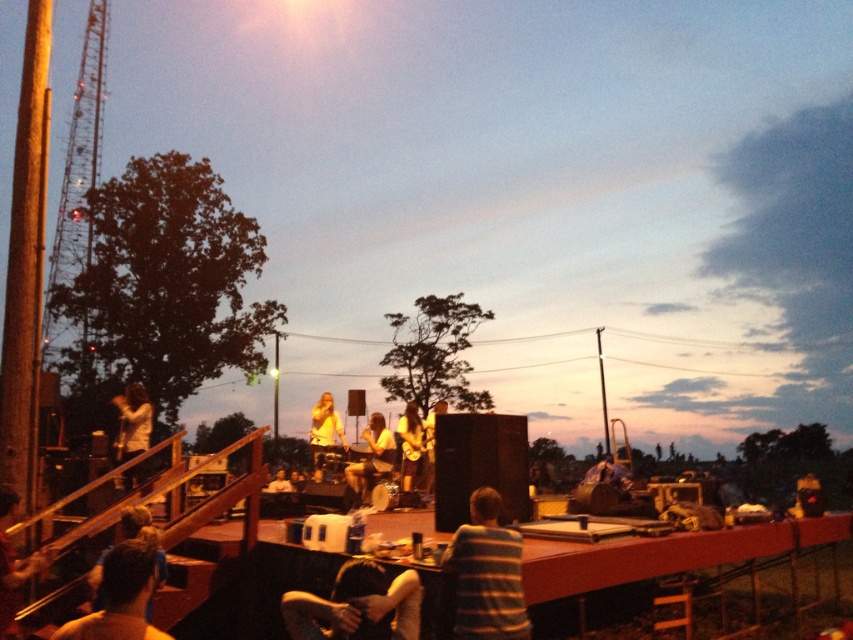
Is shiny blonde hair at center further to camera compared to smooth skin person at center?

Yes, shiny blonde hair at center is behind smooth skin person at center.

This screenshot has width=853, height=640. In order to click on shiny blonde hair at center in this screenshot , I will do `click(323, 429)`.

This screenshot has height=640, width=853. I want to click on shiny blonde hair at center, so click(x=323, y=429).

Identify the location of shiny blonde hair at center. The height and width of the screenshot is (640, 853). (323, 429).

Does shiny silver drum set at center have a lesser width compared to matte black guitar at center?

No, shiny silver drum set at center is not thinner than matte black guitar at center.

Is point (350, 476) farther from viewer compared to point (425, 451)?

No, it is not.

You are a GUI agent. You are given a task and a screenshot of the screen. Output one action in this format:
    pyautogui.click(x=<x>, y=<y>)
    Task: Click on the shiny silver drum set at center
    
    Given the screenshot: What is the action you would take?
    pyautogui.click(x=370, y=460)

You are a GUI agent. You are given a task and a screenshot of the screen. Output one action in this format:
    pyautogui.click(x=<x>, y=<y>)
    Task: Click on the shiny silver drum set at center
    This screenshot has width=853, height=640.
    Given the screenshot: What is the action you would take?
    pyautogui.click(x=370, y=460)

Who is higher up, light brown leather jacket at left or blue striped shirt at lower left?

blue striped shirt at lower left

Between point (125, 419) and point (148, 529), which one is positioned in front?

Positioned in front is point (148, 529).

Where is `light brown leather jacket at left`? The height and width of the screenshot is (640, 853). light brown leather jacket at left is located at coordinates click(x=132, y=420).